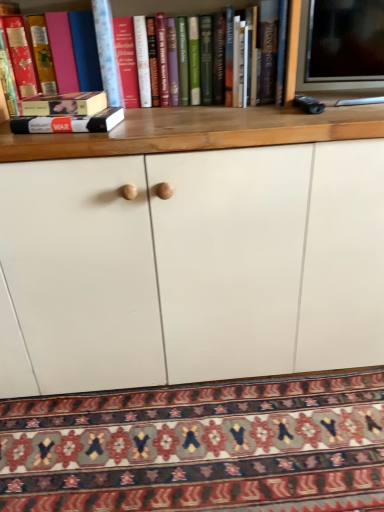
Question: Does point (18, 128) appear closer or farther from the camera than point (61, 70)?

Choices:
 (A) farther
 (B) closer

Answer: (B)

Question: Considering their positions, is hardcover book at left, the first book viewed from the right, located in front of or behind matte pink book at left, which is counted as the 2th book, starting from the bottom?

Choices:
 (A) behind
 (B) front

Answer: (B)

Question: Which is nearer to the hardcover book at left, marked as the first book in a bottom-to-top arrangement?

Choices:
 (A) matte pink book at left, which is the 2th book from right to left
 (B) patterned carpet at lower center

Answer: (A)

Question: Based on their relative distances, which object is farther from the hardcover book at left, which is the second book from left to right?

Choices:
 (A) matte pink book at left, which is counted as the 2th book, starting from the bottom
 (B) patterned carpet at lower center

Answer: (B)